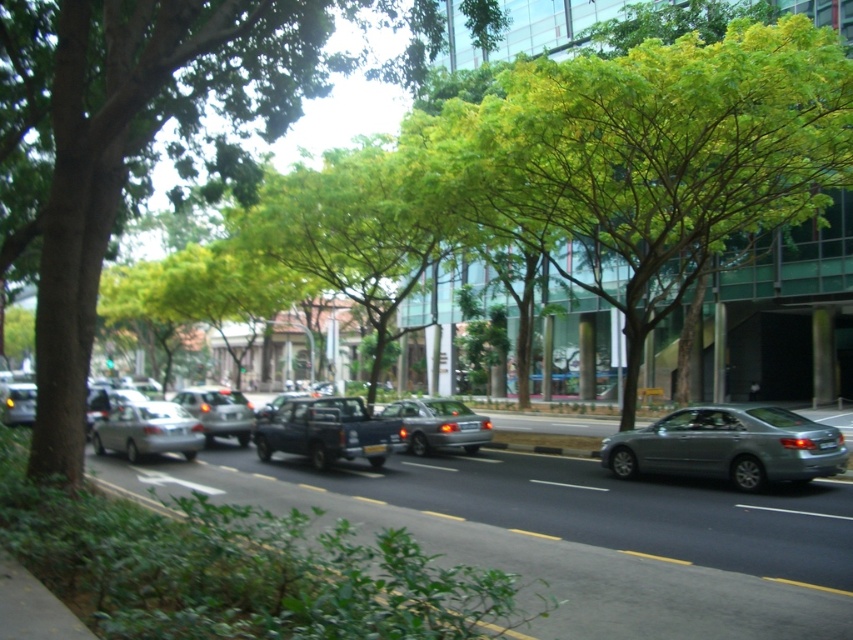
Question: Which of the following is the closest to the observer?

Choices:
 (A) matte black pickup truck at center
 (B) green leafy tree at center
 (C) satin silver sedan at center

Answer: (B)

Question: Is green leafy tree at center thinner than matte black pickup truck at center?

Choices:
 (A) yes
 (B) no

Answer: (B)

Question: Can you confirm if satin silver sedan at center is positioned above matte silver car at center?

Choices:
 (A) yes
 (B) no

Answer: (A)

Question: Which point is farther from the camera taking this photo?

Choices:
 (A) (403, 412)
 (B) (699, 461)

Answer: (A)

Question: Which of the following is the closest to the observer?

Choices:
 (A) matte black pickup truck at center
 (B) satin silver sedan at right

Answer: (B)

Question: Is satin silver sedan at right closer to camera compared to matte silver sedan at center?

Choices:
 (A) yes
 (B) no

Answer: (A)